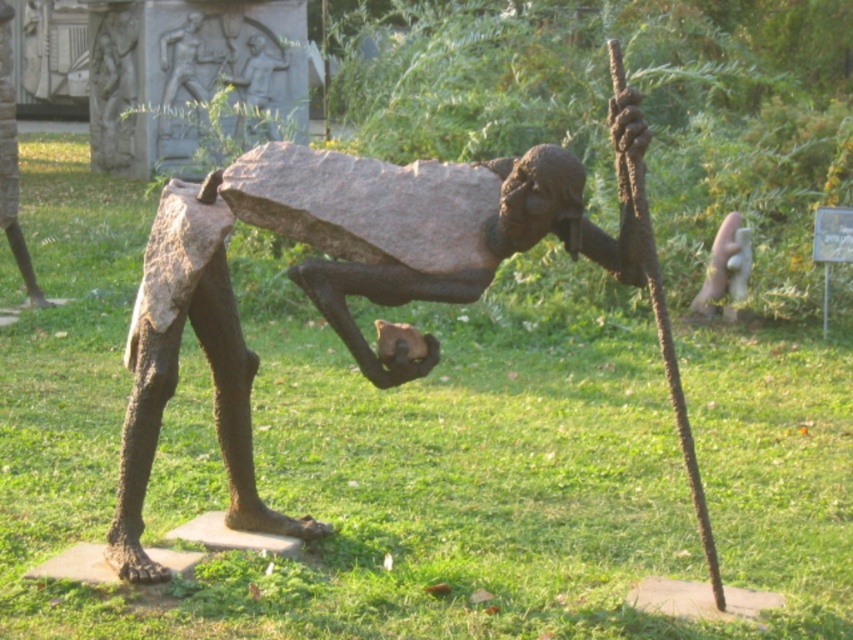
Question: Can you confirm if bronze relief figure at upper center is smaller than bronze statue at upper center?

Choices:
 (A) yes
 (B) no

Answer: (B)

Question: Can you confirm if rusty metal statue at center is positioned below bronze statue at upper center?

Choices:
 (A) no
 (B) yes

Answer: (B)

Question: Which of these objects is positioned closest to the rusty metal statue at center?

Choices:
 (A) bronze statue at left
 (B) bronze statue at upper center
 (C) bronze relief figure at upper center

Answer: (A)

Question: Which of these objects is positioned farthest from the bronze statue at upper center?

Choices:
 (A) bronze statue at left
 (B) rusty metal statue at center

Answer: (B)

Question: Does rusty metal statue at center lie in front of bronze statue at left?

Choices:
 (A) yes
 (B) no

Answer: (A)

Question: Among these objects, which one is nearest to the camera?

Choices:
 (A) bronze relief figure at upper center
 (B) rusty metal statue at center
 (C) bronze statue at upper center
 (D) bronze statue at left

Answer: (B)